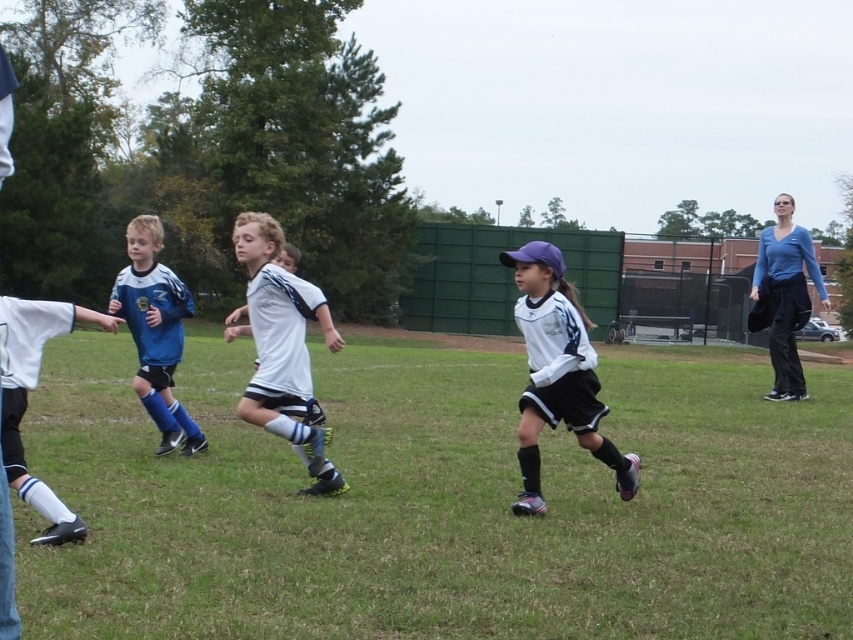
Measure the distance from white matte uniform at center to blue matte soccer jersey at left.

The distance of white matte uniform at center from blue matte soccer jersey at left is 3.65 meters.

Can you confirm if white matte uniform at center is bigger than blue matte soccer jersey at left?

Yes, white matte uniform at center is bigger than blue matte soccer jersey at left.

Between point (531, 420) and point (195, 448), which one is positioned in front?

Point (531, 420)

What are the coordinates of `white matte uniform at center` in the screenshot? It's located at (556, 372).

Which is behind, point (531, 246) or point (257, 212)?

The point (257, 212) is behind.

Is point (532, 508) positioned before point (241, 228)?

Yes, it is in front of point (241, 228).

The image size is (853, 640). In order to click on white matte uniform at center in this screenshot , I will do `click(556, 372)`.

Does white matte soccer jersey at center come in front of blue matte soccer jersey at left?

Yes, it is in front of blue matte soccer jersey at left.

Which is below, white matte soccer jersey at center or blue matte soccer jersey at left?

white matte soccer jersey at center is lower down.

Who is more forward, (273, 324) or (173, 305)?

Point (273, 324) is more forward.

Locate an element on the screen. The image size is (853, 640). white matte soccer jersey at center is located at coordinates [281, 346].